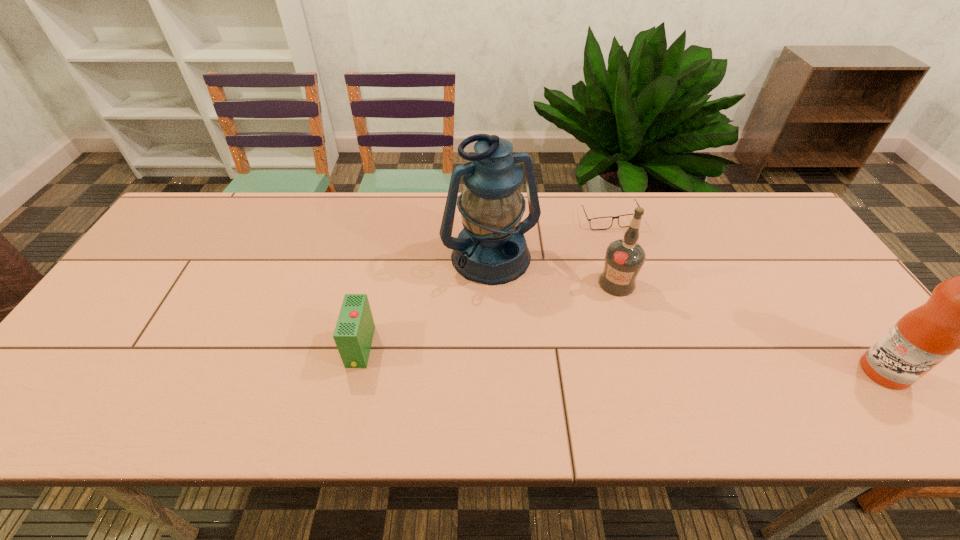
Find the location of a particular element. Image resolution: width=960 pixels, height=540 pixels. the second shortest object is located at coordinates (353, 335).

Where is `alarm clock`? alarm clock is located at coordinates (353, 335).

You are a GUI agent. You are given a task and a screenshot of the screen. Output one action in this format:
    pyautogui.click(x=<x>, y=<y>)
    Task: Click on the rightmost object
    
    Given the screenshot: What is the action you would take?
    pyautogui.click(x=959, y=313)

Find the location of a particular element. The width and height of the screenshot is (960, 540). the second tallest object is located at coordinates (959, 313).

Image resolution: width=960 pixels, height=540 pixels. Find the location of `the shortest object`. the shortest object is located at coordinates (601, 223).

This screenshot has width=960, height=540. I want to click on spectacles, so click(601, 223).

Identify the location of the third tallest object. (624, 258).

At what (x,y) coordinates should I click in order to perform the action: click on the tallest object. Please return your answer as a coordinate pair (x, y). The width and height of the screenshot is (960, 540). Looking at the image, I should click on (491, 249).

Where is `lantern`? This screenshot has height=540, width=960. lantern is located at coordinates (491, 249).

This screenshot has height=540, width=960. I want to click on vacant space positioned on the front-facing side of the fourth tallest object, so click(x=180, y=347).